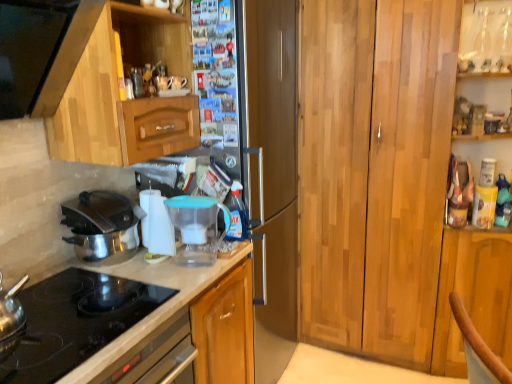
This screenshot has width=512, height=384. In order to click on vacant position to the left of transparent plastic water filter pitcher at center, which is counted as the 2th appliance, starting from the left in this screenshot , I will do `click(153, 270)`.